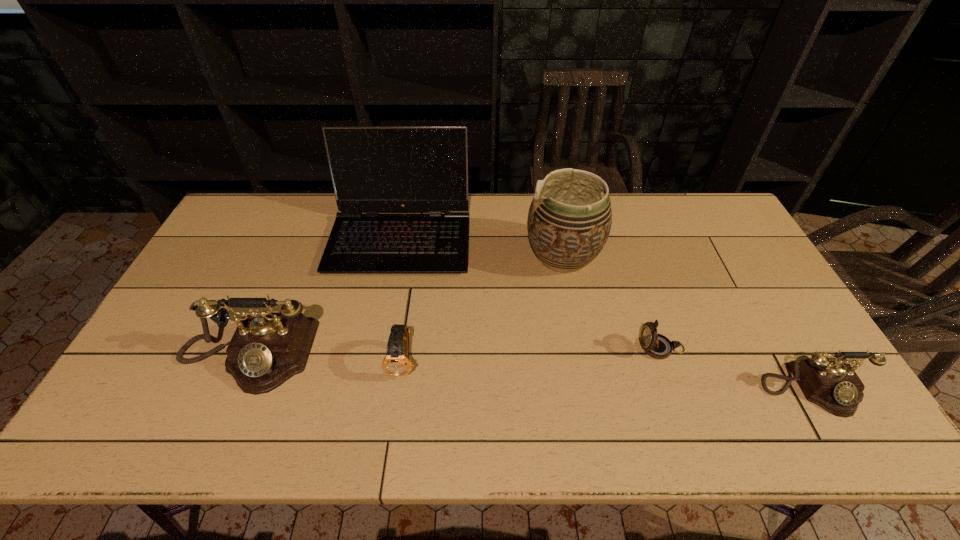
At what (x,y) coordinates should I click in order to perform the action: click on vacant space situated 0.380m on the face of the compass. Please return your answer as a coordinate pair (x, y). Image resolution: width=960 pixels, height=540 pixels. Looking at the image, I should click on (494, 348).

The width and height of the screenshot is (960, 540). In order to click on free location located 0.060m on the face of the compass in this screenshot , I will do `click(616, 348)`.

What are the coordinates of `free region located 0.140m on the face of the compass` in the screenshot? It's located at pos(586,348).

The width and height of the screenshot is (960, 540). Find the location of `pottery present at the far edge`. pottery present at the far edge is located at coordinates (569, 221).

The height and width of the screenshot is (540, 960). I want to click on laptop computer present at the far edge, so click(x=374, y=169).

The image size is (960, 540). I want to click on watch at the near edge, so click(x=396, y=362).

In order to click on object that is at the left edge in this screenshot , I will do pos(268,348).

Find the location of a particular element. object at the right edge is located at coordinates (831, 383).

Image resolution: width=960 pixels, height=540 pixels. In order to click on object that is at the near left corner in this screenshot , I will do `click(268, 348)`.

I want to click on object that is at the near right corner, so click(x=831, y=383).